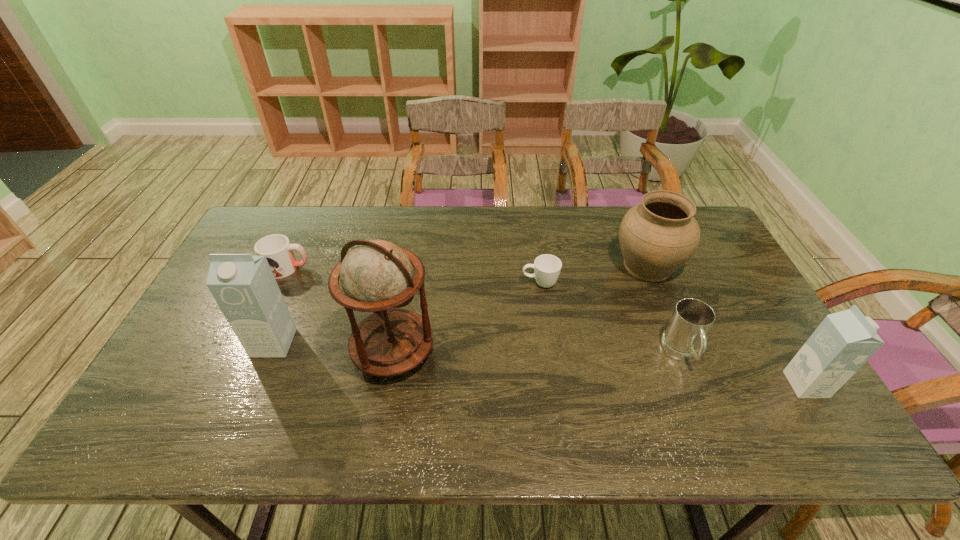
The height and width of the screenshot is (540, 960). What are the coordinates of `the second tallest object` in the screenshot? It's located at (244, 287).

You are a GUI agent. You are given a task and a screenshot of the screen. Output one action in this format:
    pyautogui.click(x=<x>, y=<y>)
    Task: Click on the farther carton
    The image size is (960, 540).
    Given the screenshot: What is the action you would take?
    pyautogui.click(x=244, y=287)

I want to click on the shorter carton, so click(844, 341).

Identify the location of the right carton. This screenshot has height=540, width=960. (844, 341).

Locate an element on the screen. the shorter mug is located at coordinates (279, 253).

This screenshot has width=960, height=540. What are the coordinates of `the farther mug` in the screenshot? It's located at coord(279,253).

Locate an element on the screen. The height and width of the screenshot is (540, 960). urn is located at coordinates (657, 237).

You are a GUI agent. You are given a task and a screenshot of the screen. Output one action in this format:
    pyautogui.click(x=<x>, y=<y>)
    Task: Click on the nearer mug
    
    Given the screenshot: What is the action you would take?
    [684, 339]

In order to click on the right mug in this screenshot , I will do `click(684, 339)`.

Where is `the shortest object`? the shortest object is located at coordinates (547, 267).